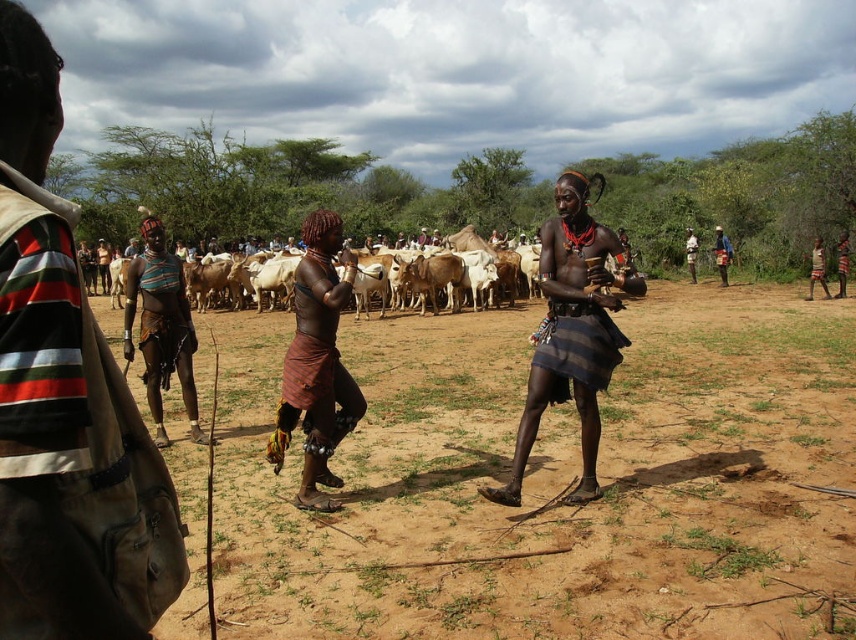
You are standing at the point with coordinates point (298, 332) and want to walk to the point with coordinates point (601, 244). Which direction should you move in to reach your destination?

You should move forward because point (601, 244) is in front of point (298, 332).

You are a photographer trying to capture the scene with a wide angle lens. You want to focus on the brown woven skirt at center but also include the matte brown leather bag at left in the frame. Since the bag is closer to you, how should you position your camera to ensure both are in focus?

The matte brown leather bag at left is closer to the viewer than brown woven skirt at center. To ensure both are in focus, you should focus on the matte brown leather bag at left and use a smaller aperture to increase depth of field, allowing both the bag and the skirt to be sharp in the photo.

You are a photographer trying to capture the scene. You want to ensure that the brown sandy ground at center and the matte brown skin at center are both visible in the frame. Which object should you focus on to ensure both are in the frame without cropping?

The brown sandy ground at center is bigger than matte brown skin at center, so focusing on the larger brown sandy ground at center will ensure both are visible in the frame without cropping.